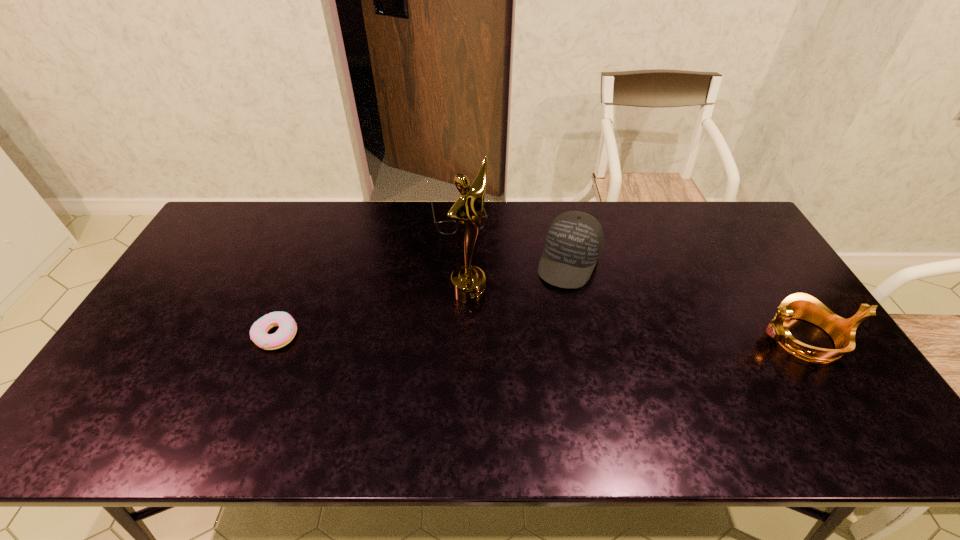
The image size is (960, 540). I want to click on free space located 0.180m at the front emblem of the tiara, so click(x=692, y=339).

Identify the location of free space located at the front of the fourth object from left to right where the brim is located. (528, 359).

This screenshot has height=540, width=960. I want to click on vacant position located 0.060m at the front of the fourth object from left to right where the brim is located, so click(554, 302).

This screenshot has height=540, width=960. I want to click on free spot located at the front of the fourth object from left to right where the brim is located, so click(x=549, y=312).

At what (x,y) coordinates should I click in order to perform the action: click on vacant position located on the front-facing side of the fourth tallest object. Please return your answer as a coordinate pair (x, y). The height and width of the screenshot is (540, 960). Looking at the image, I should click on (468, 253).

Locate an element on the screen. This screenshot has width=960, height=540. free space located on the front-facing side of the fourth tallest object is located at coordinates (471, 263).

I want to click on blank area located on the front-facing side of the fourth tallest object, so click(x=468, y=251).

This screenshot has width=960, height=540. I want to click on vacant space located on the front-facing side of the tallest object, so click(568, 352).

Where is `vacant area situated on the front-facing side of the tallest object`? This screenshot has height=540, width=960. vacant area situated on the front-facing side of the tallest object is located at coordinates (586, 362).

This screenshot has width=960, height=540. Find the location of `vacant space located 0.140m on the front-facing side of the tallest object`. vacant space located 0.140m on the front-facing side of the tallest object is located at coordinates (521, 324).